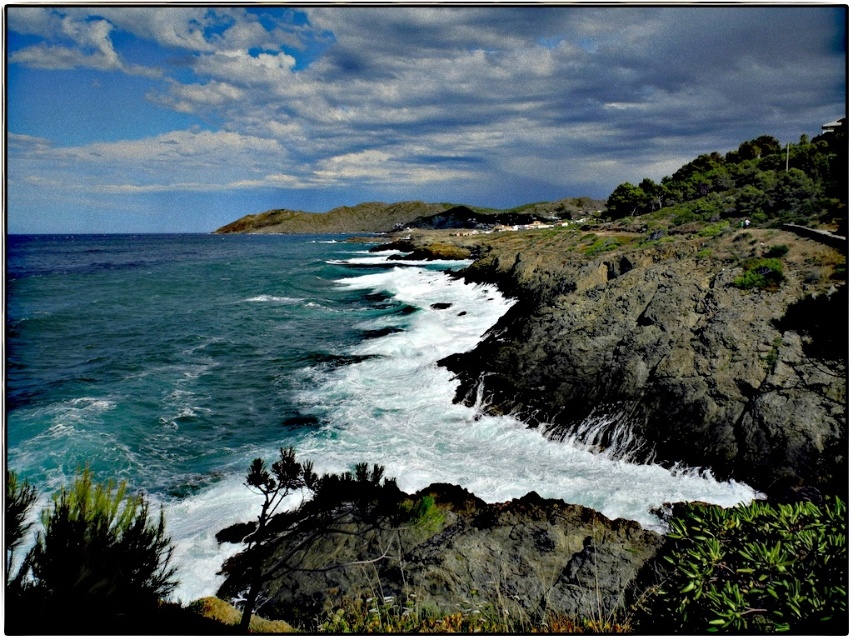
You are a geologist examining the coastal landscape. You need to determine which object occupies more horizontal space in the image. Based on the scene, which is wider between the rocky cliff at center and the dark gray rock at center?

The rocky cliff at center might be wider than dark gray rock at center according to the description.

You are standing on the cliff and want to move towards the ocean. Which object, the rocky cliff at center or the dark gray rock at center, would you encounter first?

The rocky cliff at center is in front of the dark gray rock at center, so you would encounter the rocky cliff at center first.